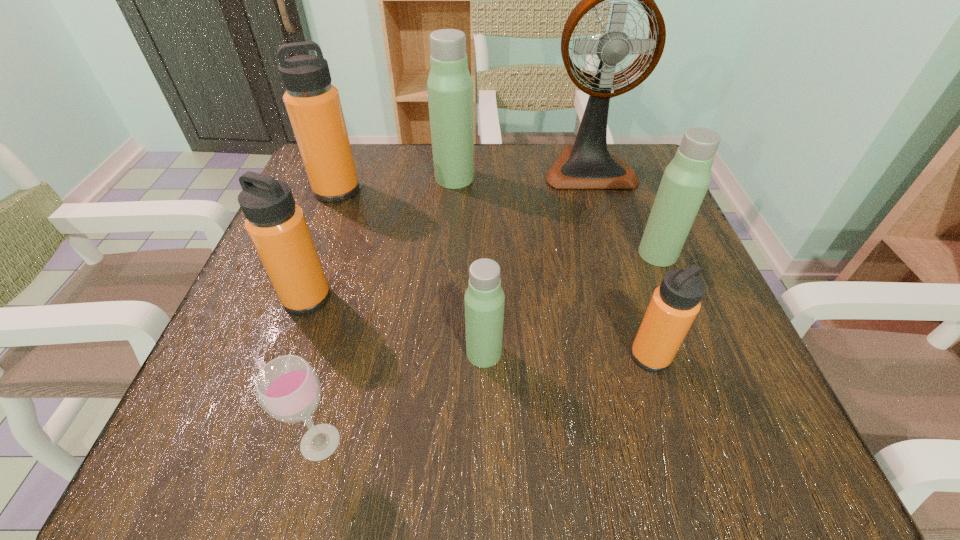
The width and height of the screenshot is (960, 540). In order to click on free region at the left edge of the desktop in this screenshot , I will do `click(346, 205)`.

The height and width of the screenshot is (540, 960). Find the location of `vacant area at the right edge`. vacant area at the right edge is located at coordinates (704, 352).

Where is `vacant space at the near right corner of the desktop`? The image size is (960, 540). vacant space at the near right corner of the desktop is located at coordinates (703, 460).

You are a GUI agent. You are given a task and a screenshot of the screen. Output one action in this format:
    pyautogui.click(x=<x>, y=<y>)
    Task: Click on the vacant area that lies between the farthest light thermos bottle and the smallest light thermos bottle
    
    Given the screenshot: What is the action you would take?
    pyautogui.click(x=469, y=266)

Image resolution: width=960 pixels, height=540 pixels. What are the coordinates of `vacant space that's between the wineglass and the rightmost orange thermos bottle` in the screenshot? It's located at (485, 399).

I want to click on vacant space that's between the wineglass and the tallest object, so click(x=454, y=305).

What are the coordinates of `vacant space that is in between the fan and the fourth nearest object` in the screenshot? It's located at (447, 233).

Locate an element on the screen. Image resolution: width=960 pixels, height=540 pixels. unoccupied area between the second biggest orange thermos bottle and the brown fan is located at coordinates (447, 233).

You are a GUI agent. You are given a task and a screenshot of the screen. Output one action in this format:
    pyautogui.click(x=<x>, y=<y>)
    Task: Click on the free area in between the nearest object and the biggest orange thermos bottle
    The image size is (960, 540).
    Given the screenshot: What is the action you would take?
    pyautogui.click(x=328, y=316)

Find the location of a particular element. free spot between the second farthest orange thermos bottle and the farthest light thermos bottle is located at coordinates (381, 238).